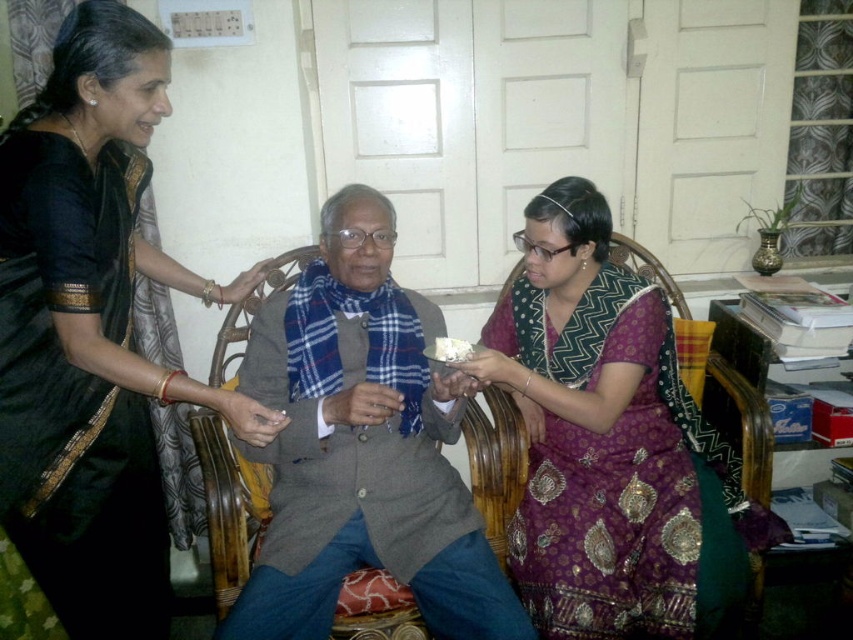
Question: Is black silk saree at upper left to the right of wicker chair at center from the viewer's perspective?

Choices:
 (A) no
 (B) yes

Answer: (A)

Question: In this image, where is black silk saree at upper left located relative to purple brocade saree at center?

Choices:
 (A) left
 (B) right

Answer: (A)

Question: Which point is closer to the camera?

Choices:
 (A) wicker chair at center
 (B) purple brocade saree at center
 (C) black silk saree at upper left

Answer: (C)

Question: From the image, what is the correct spatial relationship of purple brocade saree at center in relation to wicker chair at center?

Choices:
 (A) left
 (B) right

Answer: (B)

Question: Which point is farther to the camera?

Choices:
 (A) (527, 417)
 (B) (111, 1)

Answer: (A)

Question: Estimate the real-world distances between objects in this image. Which object is closer to the black silk saree at upper left?

Choices:
 (A) wicker chair at center
 (B) purple brocade saree at center

Answer: (A)